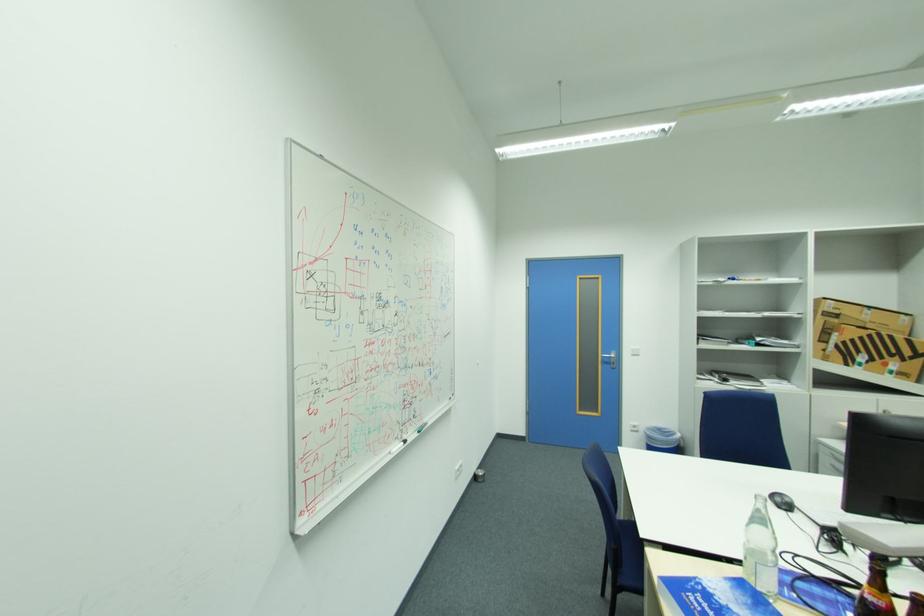
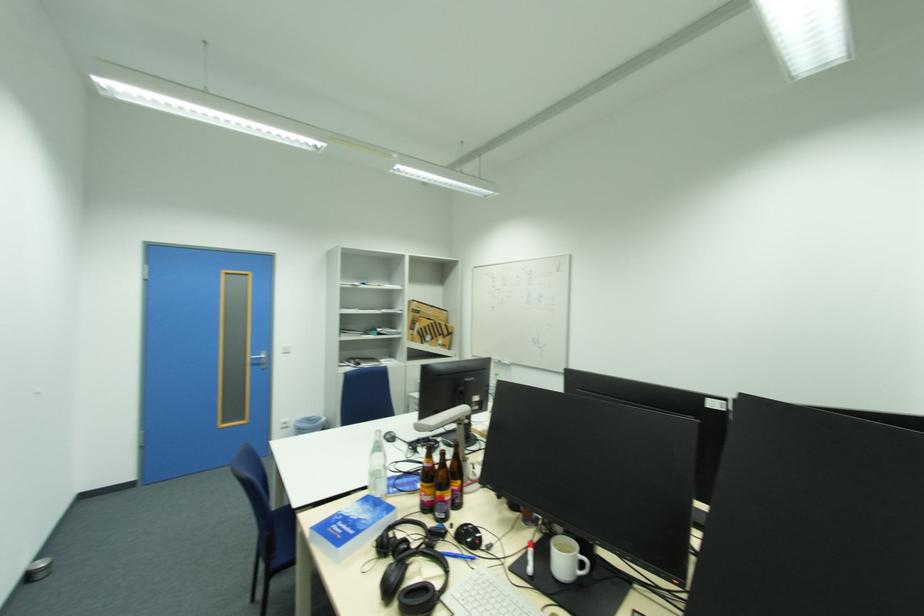
Locate, in the second image, the point that corresponds to (x=638, y=349) in the first image.

(289, 347)